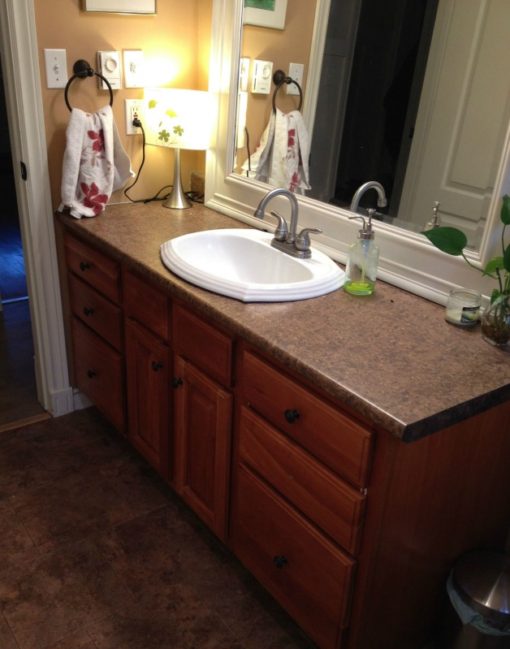
The width and height of the screenshot is (510, 649). Identify the location of vase. (499, 317).